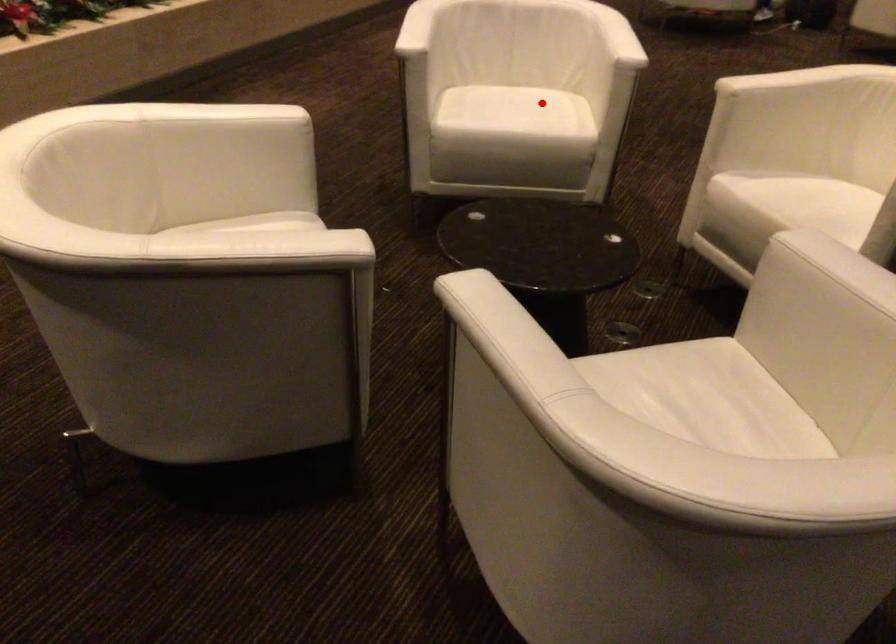
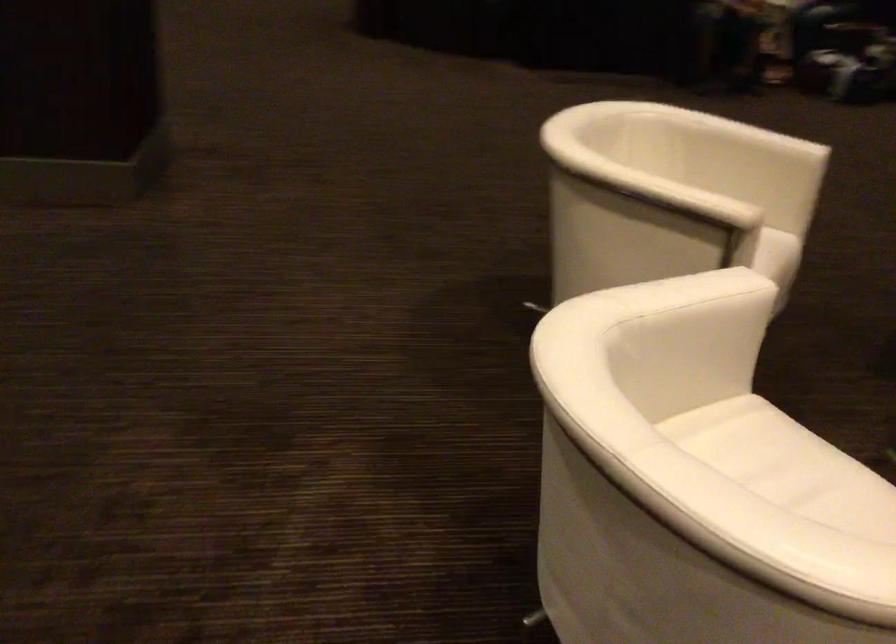
Find the pixel in the second image that matches the highlighted location in the first image.

(767, 453)